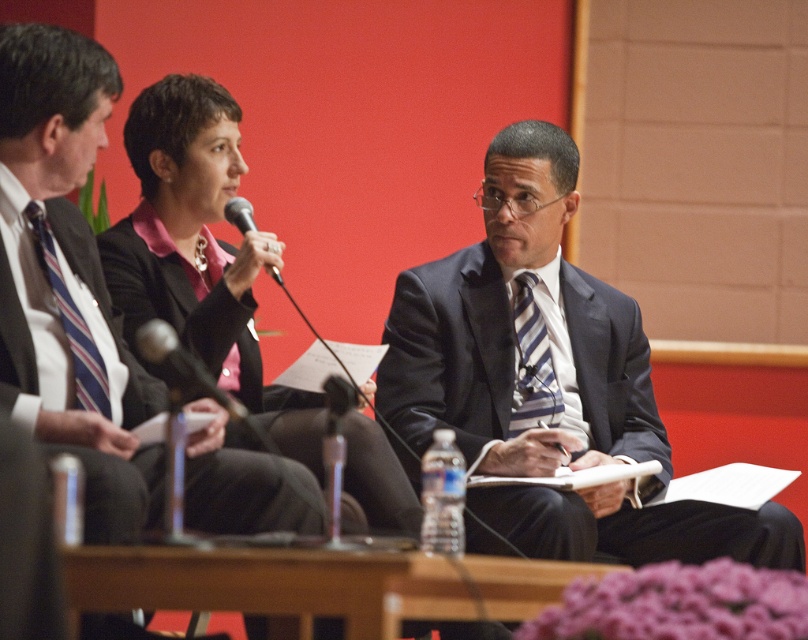
You are a photographer at the event and need to capture a clear shot of the dark blue textured suit at center and the black plastic microphone at upper center. Which object should you focus on first to ensure it appears larger in the photo?

The dark blue textured suit at center is taller than the black plastic microphone at upper center, so focusing on the dark blue textured suit at center first will ensure it appears larger in the photo.

You are a photographer setting up for a panel discussion. You need to place a light between the two points labeled point [363,429] and point [267,269]. Which point should the light be closer to in order to ensure it faces the camera properly?

The light should be placed closer to point [363,429] because it is further to the camera than point [267,269].